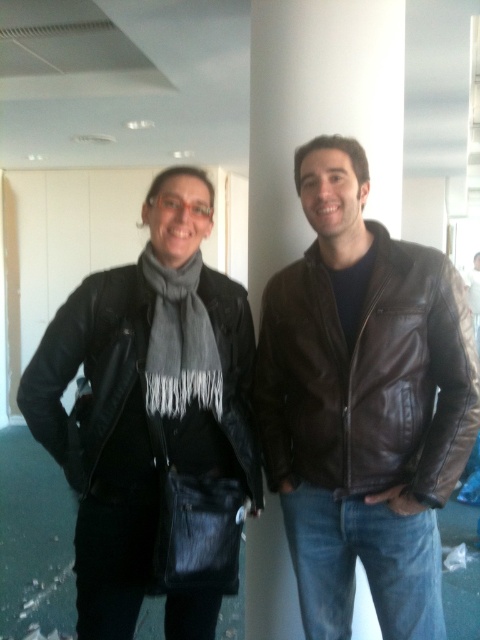
You are a photographer setting up for a group photo. You need to adjust the lighting so that both the brown leather jacket at center and the black leather jacket at left are well lit. Considering their positions, which jacket requires the light to be placed closer to it?

The brown leather jacket at center requires the light to be placed closer to it because it is closer to the viewer compared to the black leather jacket at left.

You are a photographer setting up a photo shoot in an office. You need to ensure that the brown leather jacket at center and the gray woolen scarf at center are both visible in the frame. Given their sizes, which item should you focus on to ensure both are in the frame without cropping?

The brown leather jacket at center is bigger than the gray woolen scarf at center, so focusing on the brown leather jacket at center will ensure both items are visible in the frame without cropping.

You are a photographer trying to capture a clear photo of the gray woolen scarf at center. However, the brown leather jacket at center is blocking your view. Can you move either object to get a clear shot? Explain why or why not based on their positions.

The brown leather jacket at center is in front of the gray woolen scarf at center, so you cannot move either object as they are part of the scene. To get a clear shot of the gray woolen scarf at center, you would need to adjust your angle or position to see around the brown leather jacket at center.